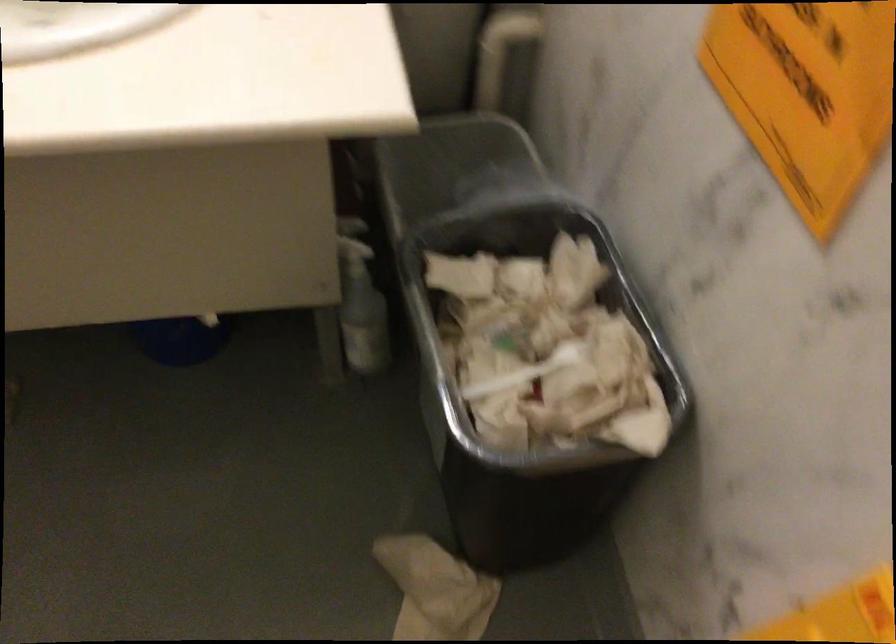
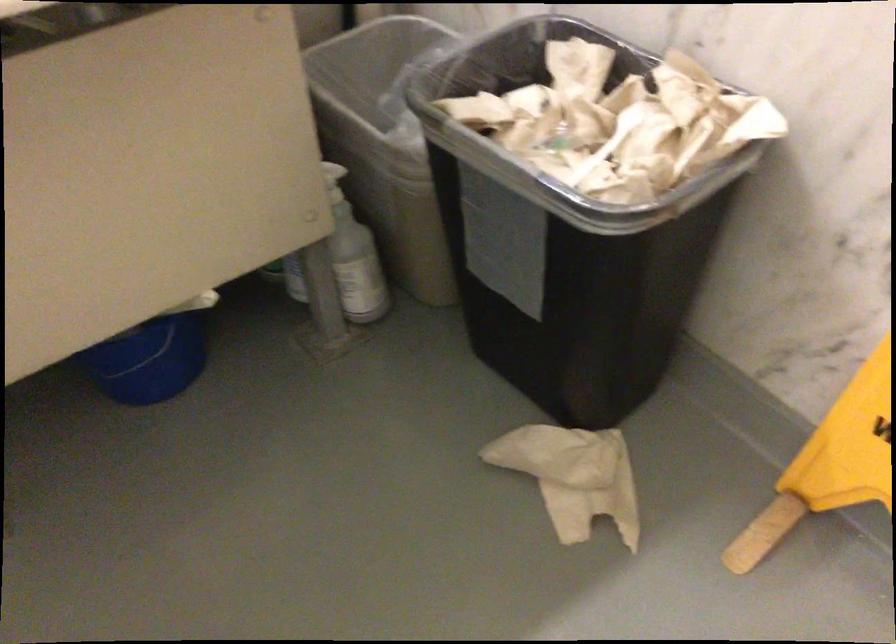
The point at (552, 344) is marked in the first image. Where is the corresponding point in the second image?

(618, 122)